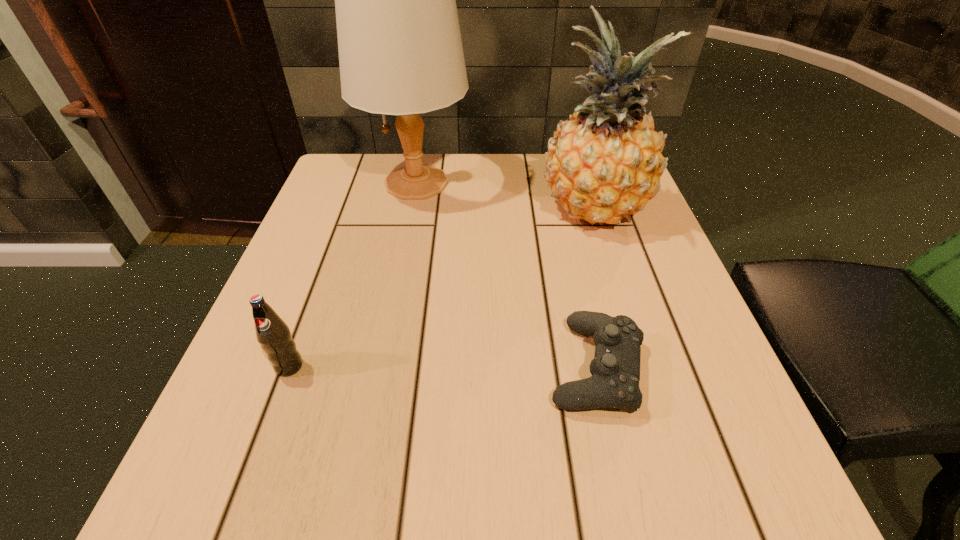
Image resolution: width=960 pixels, height=540 pixels. In order to click on table lamp present at the left edge in this screenshot , I will do `click(400, 51)`.

Locate an element on the screen. Image resolution: width=960 pixels, height=540 pixels. pop that is at the left edge is located at coordinates (272, 333).

Find the location of `pineapple that is at the right edge`. pineapple that is at the right edge is located at coordinates (604, 162).

Locate an element on the screen. control that is at the right edge is located at coordinates [615, 369].

The height and width of the screenshot is (540, 960). Identify the location of object present at the far left corner. (400, 51).

This screenshot has width=960, height=540. What are the coordinates of `object located in the far right corner section of the desktop` in the screenshot? It's located at (604, 162).

The width and height of the screenshot is (960, 540). Identify the location of free region at the far edge. (504, 159).

This screenshot has height=540, width=960. In the image, there is a desktop. In order to click on vacant region at the near edge in this screenshot , I will do `click(517, 455)`.

You are a GUI agent. You are given a task and a screenshot of the screen. Output one action in this format:
    pyautogui.click(x=<x>, y=<y>)
    Task: Click on the blank area at the left edge
    This screenshot has height=540, width=960.
    Given the screenshot: What is the action you would take?
    pyautogui.click(x=240, y=420)

Locate an element on the screen. This screenshot has height=540, width=960. free space at the right edge is located at coordinates (709, 410).